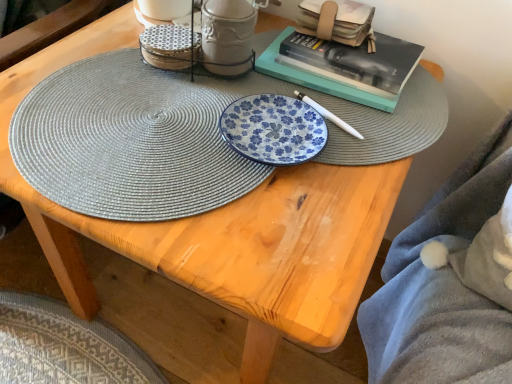
Question: Considering the relative sizes of matte ceramic mug at upper center, which ranks as the first tableware in right-to-left order, and soft gray plush blanket at lower right in the image provided, is matte ceramic mug at upper center, which ranks as the first tableware in right-to-left order, thinner than soft gray plush blanket at lower right?

Choices:
 (A) no
 (B) yes

Answer: (B)

Question: Is matte ceramic mug at upper center, which ranks as the first tableware in right-to-left order, at the right side of soft gray plush blanket at lower right?

Choices:
 (A) yes
 (B) no

Answer: (B)

Question: Can you confirm if matte ceramic mug at upper center, which is the second tableware in left-to-right order, is wider than soft gray plush blanket at lower right?

Choices:
 (A) no
 (B) yes

Answer: (A)

Question: Can you confirm if matte ceramic mug at upper center, which is the second tableware in left-to-right order, is smaller than soft gray plush blanket at lower right?

Choices:
 (A) no
 (B) yes

Answer: (B)

Question: Is matte ceramic mug at upper center, which ranks as the first tableware in right-to-left order, further to camera compared to soft gray plush blanket at lower right?

Choices:
 (A) no
 (B) yes

Answer: (B)

Question: From a real-world perspective, is matte gray woven placemat at center physically located above or below porcelain textured coasters at upper center, marked as the 2th tableware in a right-to-left arrangement?

Choices:
 (A) above
 (B) below

Answer: (B)

Question: Is matte gray woven placemat at center wider or thinner than porcelain textured coasters at upper center, marked as the 2th tableware in a right-to-left arrangement?

Choices:
 (A) thin
 (B) wide

Answer: (B)

Question: Based on their sizes in the image, would you say matte gray woven placemat at center is bigger or smaller than porcelain textured coasters at upper center, marked as the 2th tableware in a right-to-left arrangement?

Choices:
 (A) small
 (B) big

Answer: (B)

Question: From the image's perspective, is matte gray woven placemat at center above or below porcelain textured coasters at upper center, marked as the 2th tableware in a right-to-left arrangement?

Choices:
 (A) above
 (B) below

Answer: (B)

Question: Considering the positions of point (90, 140) and point (440, 228), is point (90, 140) closer or farther from the camera than point (440, 228)?

Choices:
 (A) closer
 (B) farther

Answer: (A)

Question: Looking at their shapes, would you say matte gray woven placemat at center is wider or thinner than soft gray plush blanket at lower right?

Choices:
 (A) wide
 (B) thin

Answer: (A)

Question: Would you say matte gray woven placemat at center is to the left or to the right of soft gray plush blanket at lower right in the picture?

Choices:
 (A) left
 (B) right

Answer: (A)

Question: Would you say matte gray woven placemat at center is inside or outside soft gray plush blanket at lower right?

Choices:
 (A) outside
 (B) inside

Answer: (A)

Question: Is point (246, 54) closer or farther from the camera than point (180, 147)?

Choices:
 (A) closer
 (B) farther

Answer: (B)

Question: From the image's perspective, is matte ceramic mug at upper center, which is the second tableware in left-to-right order, located above or below matte gray woven placemat at center?

Choices:
 (A) below
 (B) above

Answer: (B)